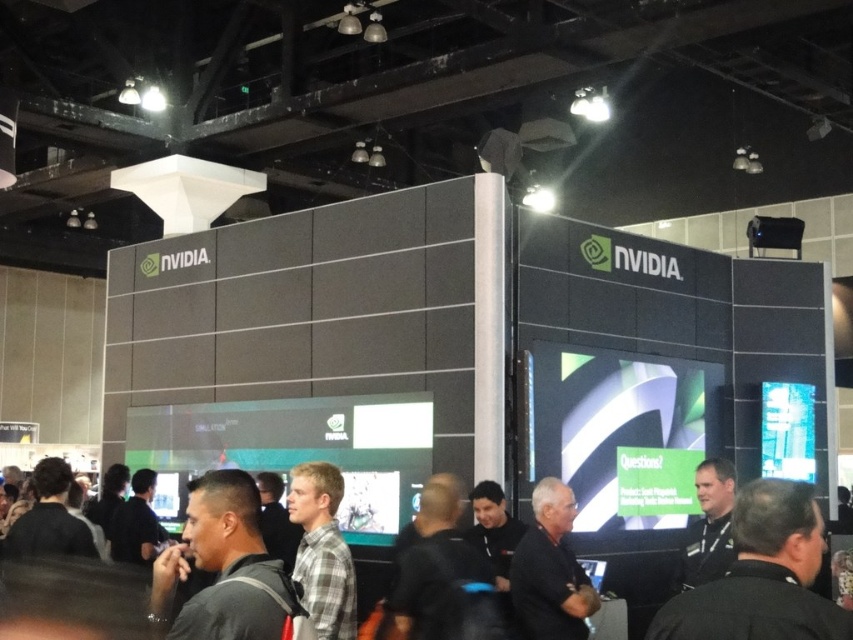
You are at the NVIDIA booth and want to approach the person wearing the dark gray shirt at center. Given the coordinates provided, can you estimate whether the person is closer to the front or back of the booth?

The coordinates of the dark gray shirt at center are at point (224, 566). Since the x and y values are both above 0.5, this indicates the person is closer to the back of the booth.

You are a photographer at the NVIDIA booth and need to capture both the black uniform at center and the dark gray shirt at center in a single photo. What is the minimum distance you should position your camera from the booth to ensure both are fully visible?

The black uniform at center and dark gray shirt at center are 5.28 feet apart. To capture both in a single photo, the camera should be positioned at least 5.28 feet away from the booth to ensure the entire distance between them is within the frame.

Looking at this image, you are an attendee at the NVIDIA booth and want to take a photo of the black uniform at center and the black shirt at center. Which one will appear larger in your photo?

The black uniform at center will appear larger in your photo because it is closer to the viewer than the black shirt at center.